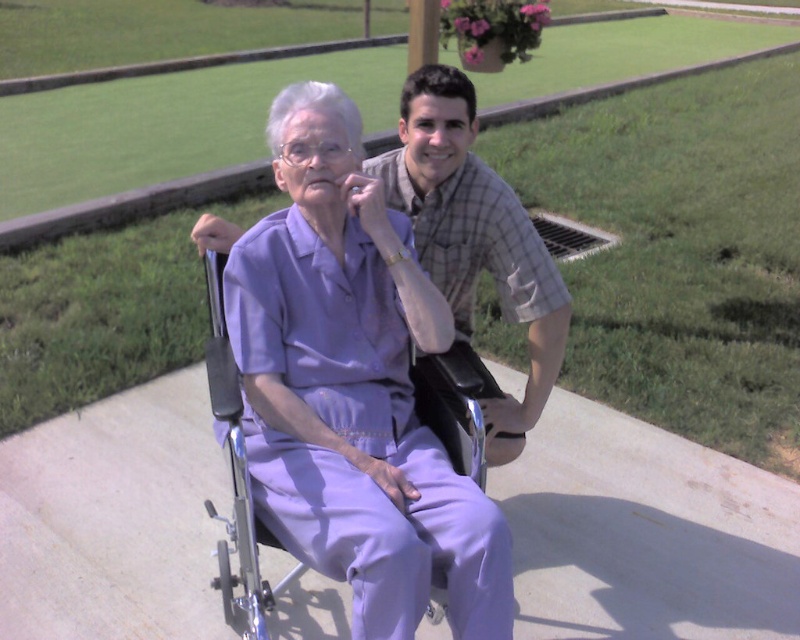
You are standing at the point with coordinates point (236, 413) and want to walk towards the point with coordinates point (468, 323). Which direction should you move relative to your current position?

You should move backward because point (468, 323) is behind point (236, 413) relative to your current position.

You are a photographer trying to capture a closeup of the plaid cotton shirt at center and the metallic silver wheelchair at center. Which object should you focus on first to ensure it appears sharp in your photo?

The plaid cotton shirt at center is closer to the viewer than the metallic silver wheelchair at center, so you should focus on the plaid cotton shirt at center first to ensure it appears sharp.

What is the 2D coordinate of the plaid cotton shirt at center?

The plaid cotton shirt at center is located at the 2D coordinate point of (474, 237).